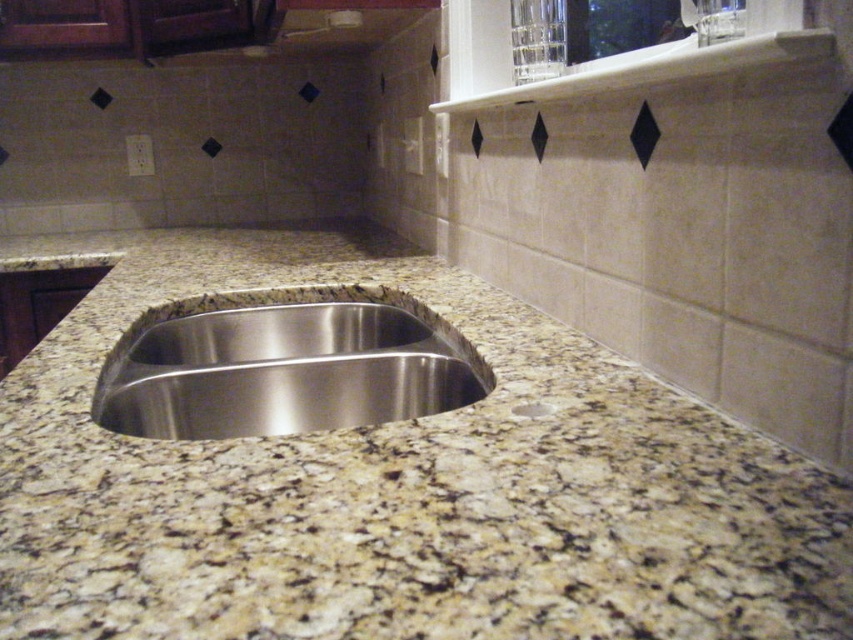
Does point (286, 360) come in front of point (515, 404)?

That is False.

Find the location of a particular element. This screenshot has height=640, width=853. stainless steel sink at center is located at coordinates (283, 371).

Is granite at center positioned at the back of stainless steel sink at center?

No, it is not.

Is granite at center closer to the viewer compared to stainless steel sink at center?

Yes, it is.

Does point (103, 556) come behind point (352, 323)?

No.

Identify the location of granite at center. The width and height of the screenshot is (853, 640). (399, 483).

In the scene shown: Is granite at center above white marble drain at center?

Yes.

Measure the distance from granite at center to white marble drain at center.

17.63 inches

Is point (666, 532) more distant than point (543, 401)?

That is False.

This screenshot has width=853, height=640. In order to click on granite at center in this screenshot , I will do `click(399, 483)`.